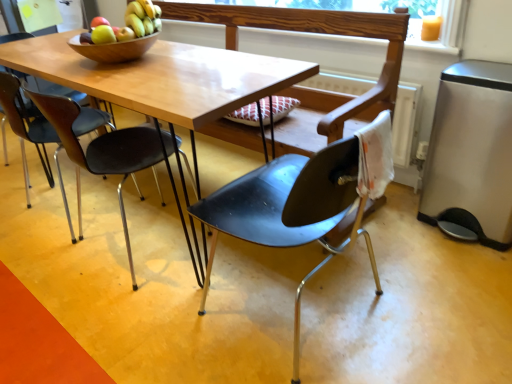
Locate an element on the screen. The height and width of the screenshot is (384, 512). vacant area that lies between black plastic chair at left, which appears as the second chair when viewed from the right, and matte black chair at left, acting as the 3th chair starting from the right is located at coordinates (104, 246).